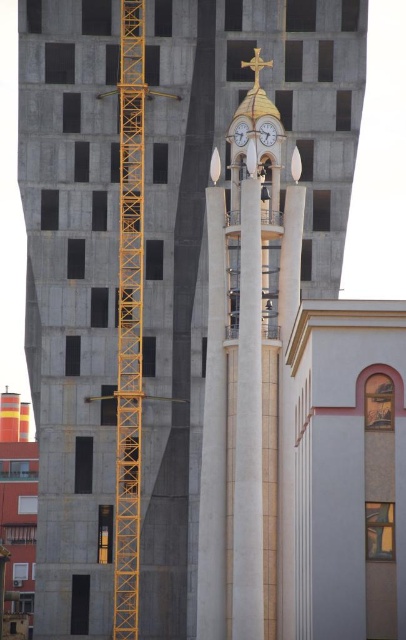
Question: Can you confirm if yellow metallic crane at left is positioned below metallic gold clock at upper center?

Choices:
 (A) no
 (B) yes

Answer: (B)

Question: Is yellow metallic crane at left thinner than metallic gold clock at upper center?

Choices:
 (A) no
 (B) yes

Answer: (A)

Question: Which point is farther from the camera taking this photo?

Choices:
 (A) (269, 129)
 (B) (244, 138)

Answer: (A)

Question: Is the position of yellow metallic crane at left less distant than that of white glossy clock at upper center?

Choices:
 (A) no
 (B) yes

Answer: (A)

Question: Estimate the real-world distances between objects in this image. Which object is farther from the metallic gold clock at upper center?

Choices:
 (A) yellow metallic crane at left
 (B) white glossy clock at upper center

Answer: (A)

Question: Which point appears farthest from the camera in this image?

Choices:
 (A) (265, 128)
 (B) (237, 141)

Answer: (B)